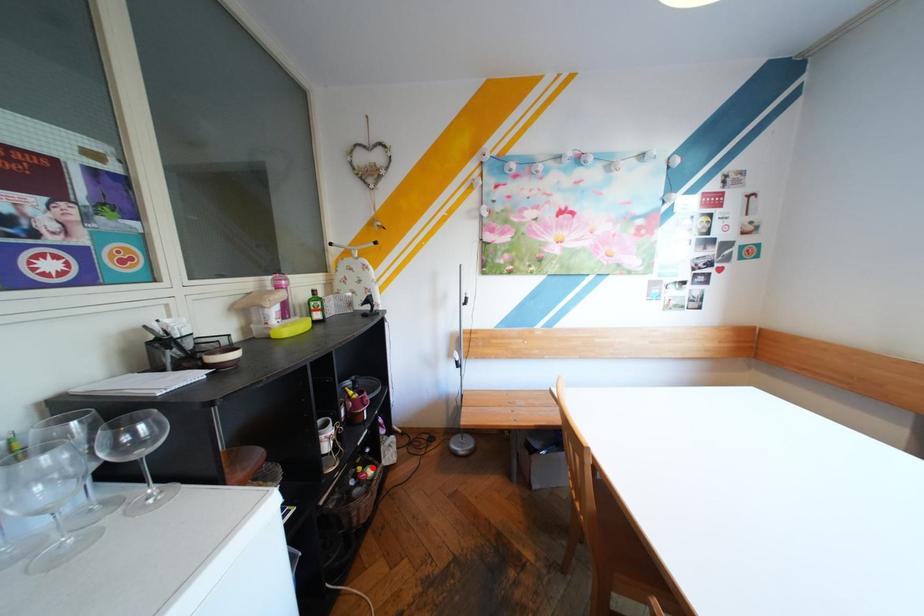
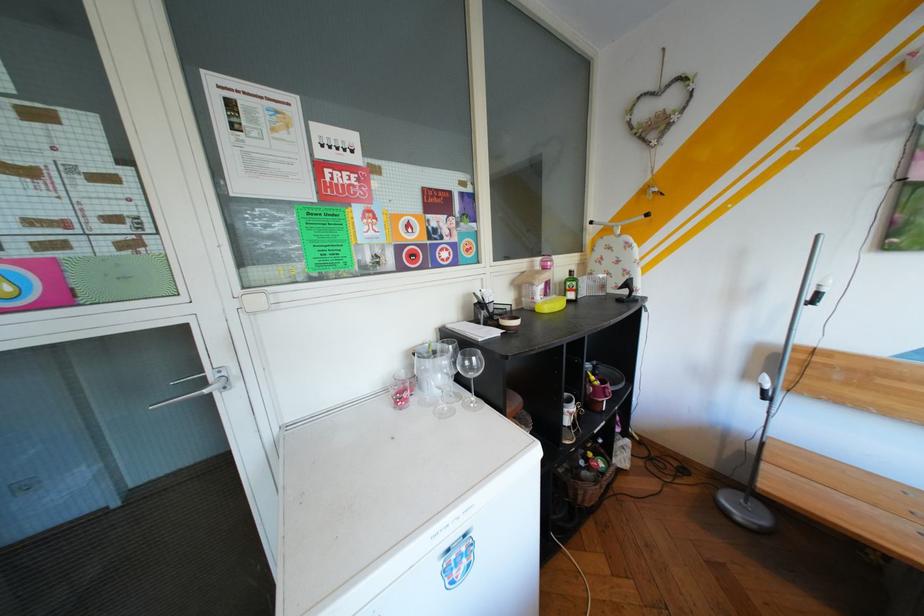
Question: I am providing you with two images of the same scene from different viewpoints. A red point is shown in image1. For the corresponding object point in image2, is it positioned nearer or farther from the camera?

Choices:
 (A) Nearer
 (B) Farther

Answer: (B)